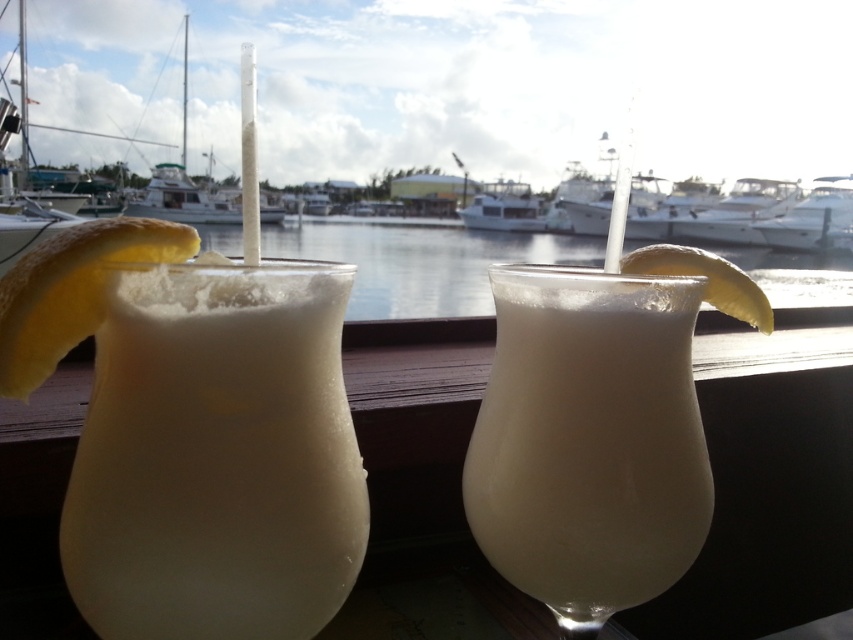
Question: Which of the following is the farthest from the observer?

Choices:
 (A) white frothy drink at center
 (B) white glossy boat at right
 (C) white frothy drink at left

Answer: (B)

Question: Is yellow matte lemon at right smaller than white glossy boat at right?

Choices:
 (A) no
 (B) yes

Answer: (B)

Question: Can you confirm if white frothy drink at center is bigger than white glossy boat at center?

Choices:
 (A) no
 (B) yes

Answer: (A)

Question: Estimate the real-world distances between objects in this image. Which object is closer to the white frothy drink at left?

Choices:
 (A) white glossy boat at right
 (B) translucent liquid at center

Answer: (B)

Question: Estimate the real-world distances between objects in this image. Which object is farther from the white frothy drink at left?

Choices:
 (A) white frothy drink at center
 (B) translucent liquid at center
 (C) white glossy boat at center

Answer: (C)

Question: Does yellow matte lemon at right appear on the left side of white glossy boat at right?

Choices:
 (A) no
 (B) yes

Answer: (B)